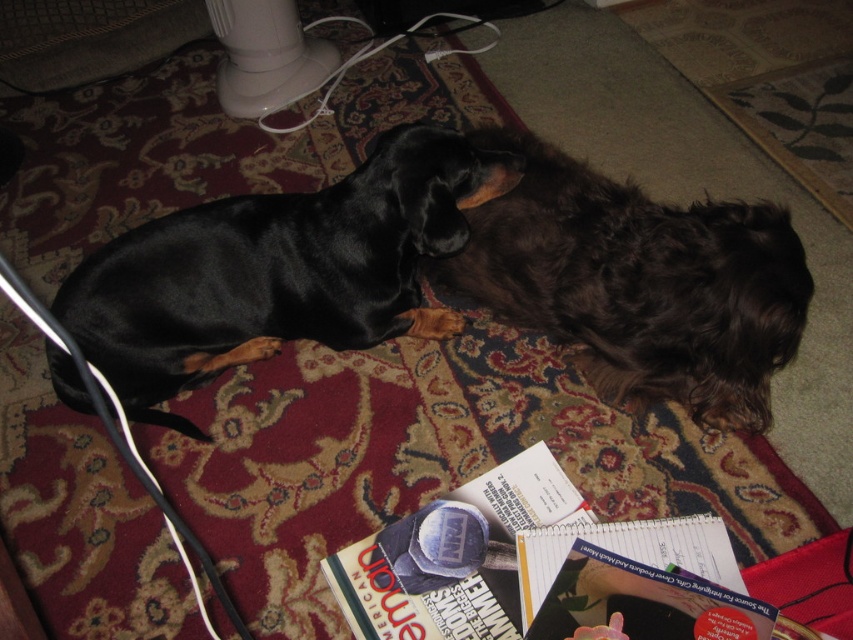
Question: Does black shiny dog at left have a lesser width compared to shaggy brown dog at center?

Choices:
 (A) no
 (B) yes

Answer: (A)

Question: Is black shiny dog at left bigger than shaggy brown dog at center?

Choices:
 (A) yes
 (B) no

Answer: (B)

Question: Does black shiny dog at left have a smaller size compared to shaggy brown dog at center?

Choices:
 (A) no
 (B) yes

Answer: (B)

Question: Which point is closer to the camera taking this photo?

Choices:
 (A) (61, 396)
 (B) (598, 317)

Answer: (B)